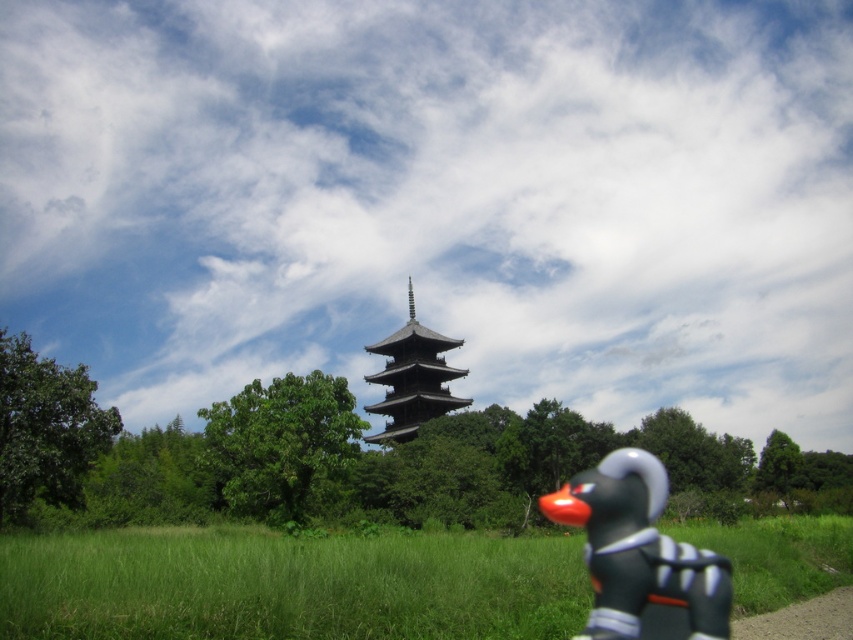
Question: Which object is the closest to the green grassy field at lower center?

Choices:
 (A) matte black figurine at lower right
 (B) dark brown wooden tower at center

Answer: (A)

Question: Which of the following is the farthest from the observer?

Choices:
 (A) (292, 586)
 (B) (619, 582)

Answer: (A)

Question: Does matte black figurine at lower right appear on the left side of dark brown wooden tower at center?

Choices:
 (A) no
 (B) yes

Answer: (A)

Question: Which of the following is the farthest from the observer?

Choices:
 (A) (416, 326)
 (B) (137, 616)
 (C) (613, 636)

Answer: (A)

Question: In this image, where is green grassy field at lower center located relative to matte black figurine at lower right?

Choices:
 (A) left
 (B) right

Answer: (A)

Question: Is green grassy field at lower center positioned behind matte black figurine at lower right?

Choices:
 (A) yes
 (B) no

Answer: (A)